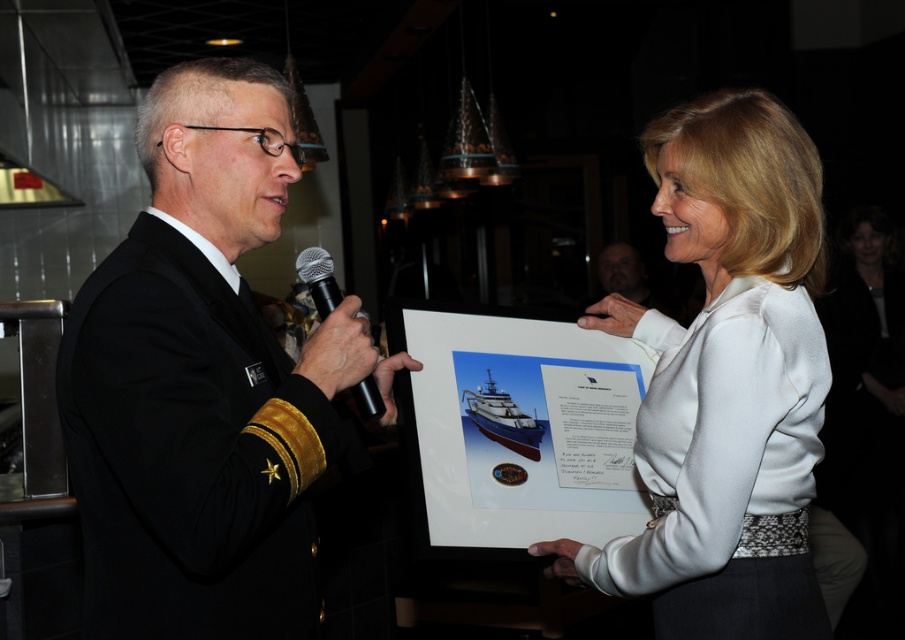
You are an event planner arranging a photo shoot for the formal event. You need to ensure that the white satin blouse at center and the black metallic microphone at center are visible in the photo. Which object should be placed closer to the camera to maintain their visibility?

The white satin blouse at center has a greater height compared to the black metallic microphone at center. To ensure both are visible, the black metallic microphone at center should be placed closer to the camera since it is shorter and might otherwise be obscured by the taller blouse.

You are planning to hang both the black uniform at left and the dark brown leather jacket at upper center on a single coat rack. Which one should you place first to ensure both fit properly?

The black uniform at left might be wider than dark brown leather jacket at upper center, so you should place the black uniform at left first to accommodate its width before hanging the dark brown leather jacket at upper center.

You are a photographer at this event and need to position yourself so that the white satin blouse at center and the dark brown leather jacket at upper center are both visible in your shot. Based on their positions, which side should you stand relative to the subjects to ensure both items are in frame?

→ You should stand to the right of the subjects because the white satin blouse at center is to the left of the dark brown leather jacket at upper center, so positioning yourself to the right would allow both items to be captured in the frame.